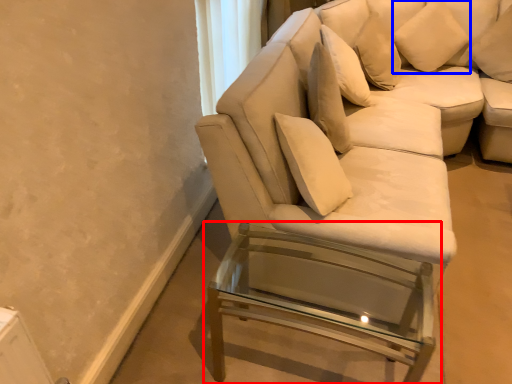
Question: Among these objects, which one is nearest to the camera, table (highlighted by a red box) or pillow (highlighted by a blue box)?

Choices:
 (A) table
 (B) pillow

Answer: (A)